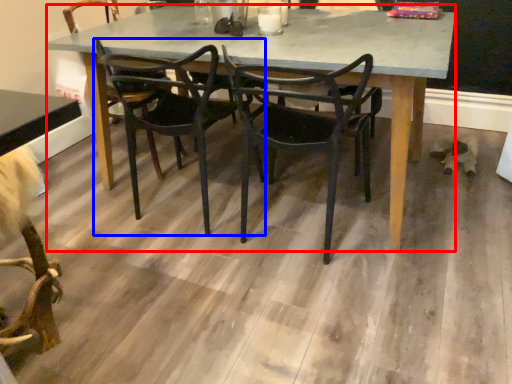
Question: Which of the following is the closest to the observer, kitchen & dining room table (highlighted by a red box) or chair (highlighted by a blue box)?

Choices:
 (A) kitchen & dining room table
 (B) chair

Answer: (A)